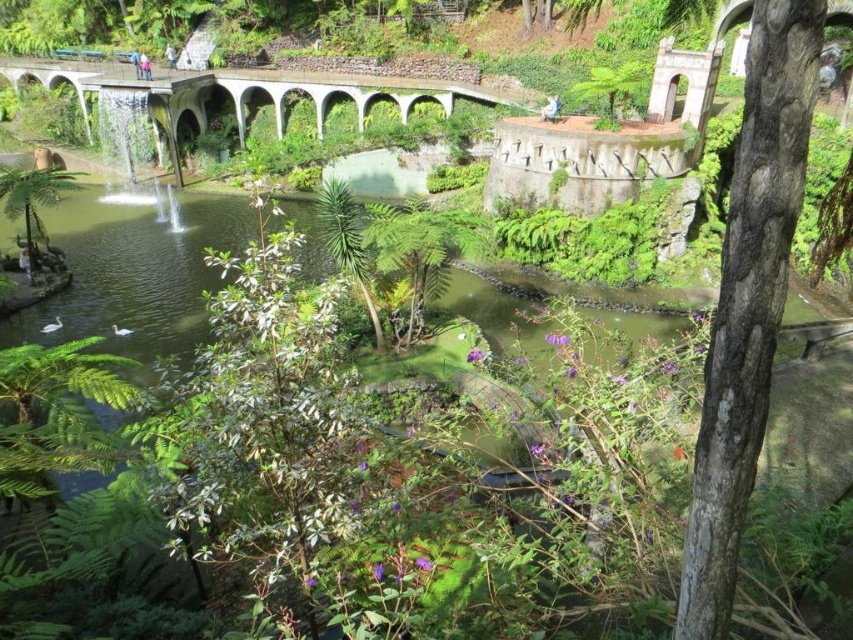
Question: Which point is closer to the camera taking this photo?

Choices:
 (A) (764, 106)
 (B) (177, 182)
 (C) (287, 298)

Answer: (A)

Question: Does green leafy tree at center appear on the right side of white stone bridge at center?

Choices:
 (A) yes
 (B) no

Answer: (A)

Question: Does smooth gray bark at center have a lesser width compared to white stone bridge at center?

Choices:
 (A) yes
 (B) no

Answer: (A)

Question: Among these objects, which one is farthest from the camera?

Choices:
 (A) smooth gray bark at center
 (B) green leafy tree at center

Answer: (B)

Question: Which of the following is the closest to the observer?

Choices:
 (A) (355, 104)
 (B) (167, 499)

Answer: (B)

Question: Does green leafy tree at center have a smaller size compared to white stone bridge at center?

Choices:
 (A) no
 (B) yes

Answer: (B)